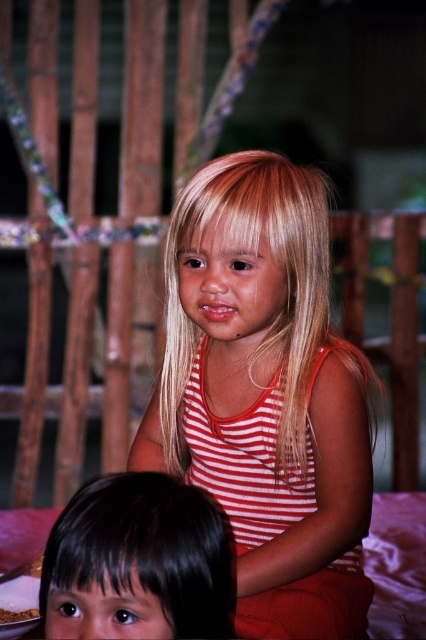
Question: Which object is farther from the camera taking this photo?

Choices:
 (A) striped fabric tank top at center
 (B) black hair at lower left

Answer: (A)

Question: Does striped fabric tank top at center come in front of black hair at lower left?

Choices:
 (A) yes
 (B) no

Answer: (B)

Question: Among these points, which one is nearest to the camera?

Choices:
 (A) (273, 296)
 (B) (181, 534)

Answer: (B)

Question: Can you confirm if striped fabric tank top at center is positioned to the right of black hair at lower left?

Choices:
 (A) no
 (B) yes

Answer: (B)

Question: Is striped fabric tank top at center in front of black hair at lower left?

Choices:
 (A) yes
 (B) no

Answer: (B)